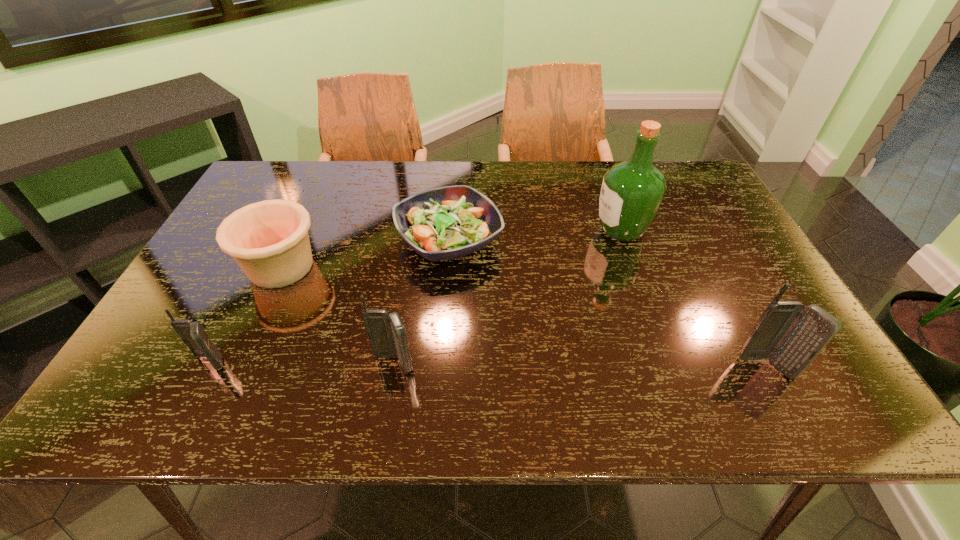
Where is `free space at the near edge`? The height and width of the screenshot is (540, 960). free space at the near edge is located at coordinates (613, 354).

In the image, there is a desktop. At what (x,y) coordinates should I click in order to perform the action: click on vacant space at the left edge. Please return your answer as a coordinate pair (x, y). The width and height of the screenshot is (960, 540). Looking at the image, I should click on (229, 273).

The image size is (960, 540). In the image, there is a desktop. Find the location of `blank space at the right edge`. blank space at the right edge is located at coordinates (702, 247).

Find the location of a particular element. This screenshot has height=540, width=960. blank area at the far left corner is located at coordinates (300, 181).

This screenshot has width=960, height=540. I want to click on blank area at the far right corner, so click(673, 163).

You are a GUI agent. You are given a task and a screenshot of the screen. Output one action in this format:
    pyautogui.click(x=<x>, y=<y>)
    Task: Click on the vacant area that lies between the second cellular telephone from right to left and the tallest object
    This screenshot has height=540, width=960.
    Given the screenshot: What is the action you would take?
    pyautogui.click(x=508, y=297)

The width and height of the screenshot is (960, 540). In order to click on free space between the shortest cellular telephone and the shortest object in this screenshot , I will do `click(329, 301)`.

Locate an element on the screen. This screenshot has width=960, height=540. vacant region between the rightmost cellular telephone and the leftmost cellular telephone is located at coordinates (488, 365).

I want to click on free spot between the pottery and the salad plate, so click(365, 253).

At what (x,y) coordinates should I click in order to perform the action: click on vacant space that's between the second tallest object and the salad plate. Please return your answer as a coordinate pair (x, y). Image resolution: width=960 pixels, height=540 pixels. Looking at the image, I should click on (608, 304).